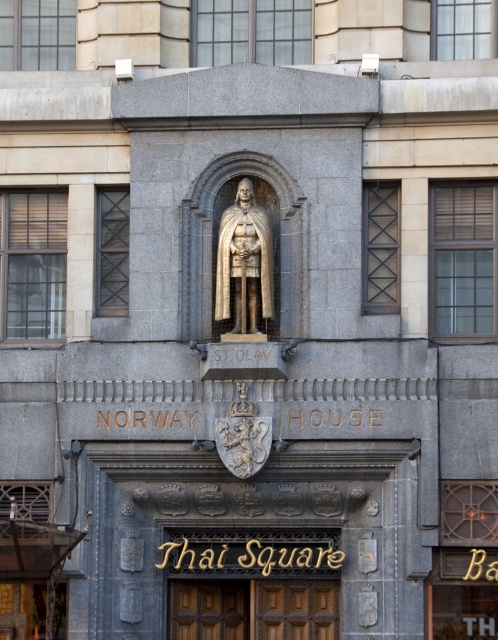
You are an architect examining the building facade. You notice the gold wood sign at center and the gold polished statue at center. Which object has a smaller width?

The gold wood sign at center has a lesser width compared to the gold polished statue at center.

What is the spatial relationship between the gold wood sign at center and the gold polished statue at center from the observer standing in front of the building?

The gold wood sign at center is closer to the observer than the gold polished statue at center, as it is positioned further forward in the facade.